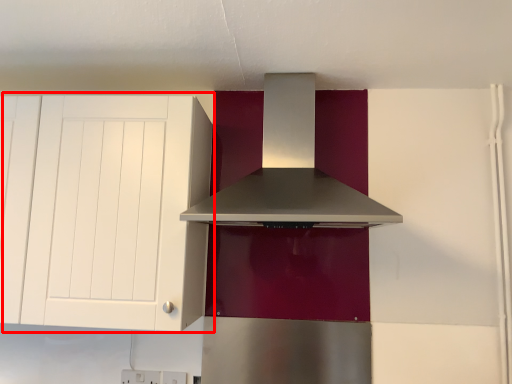
Question: From the image, what is the correct spatial relationship of cabinetry (annotated by the red box) in relation to home appliance?

Choices:
 (A) left
 (B) right

Answer: (A)